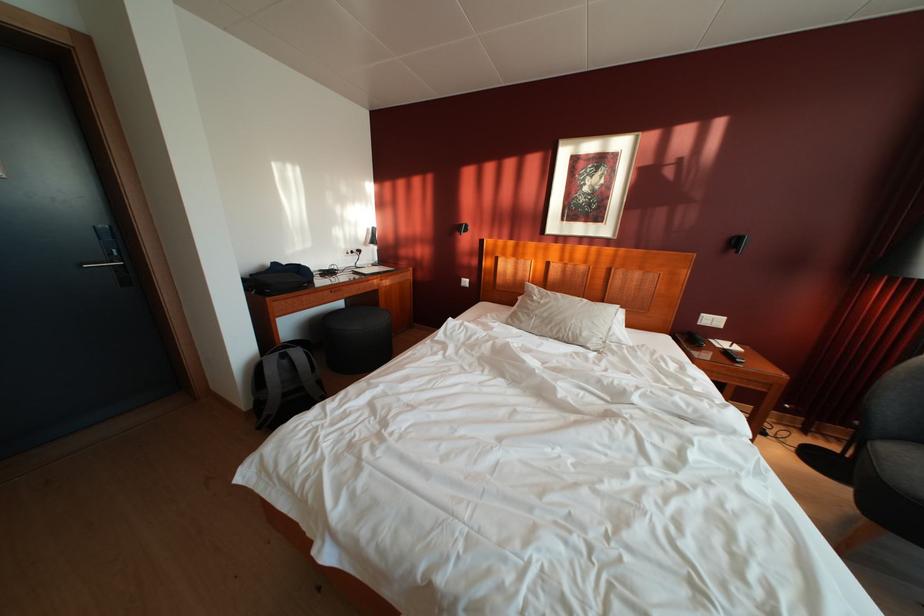
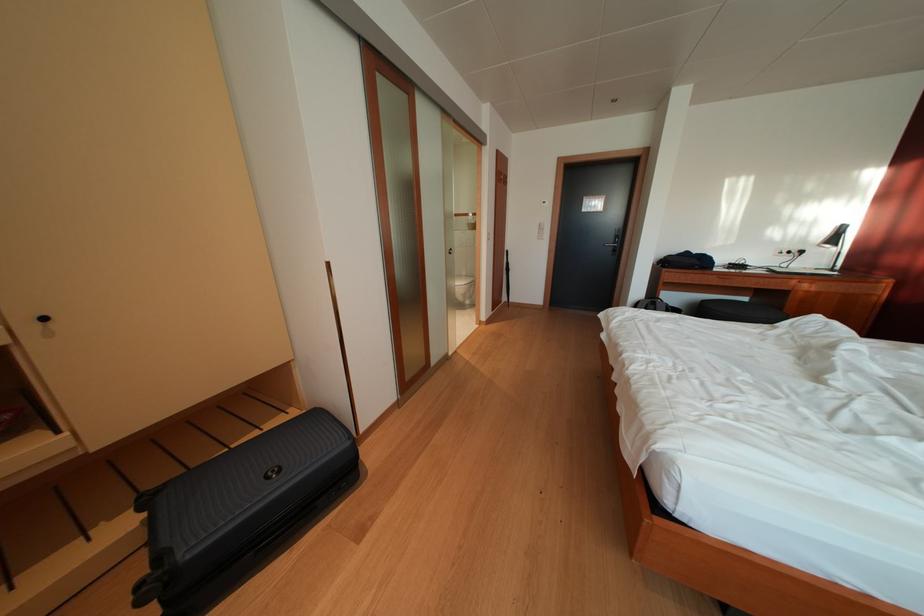
Where in the second image is the point corresponding to the point at 382,246 from the first image?

(842, 246)